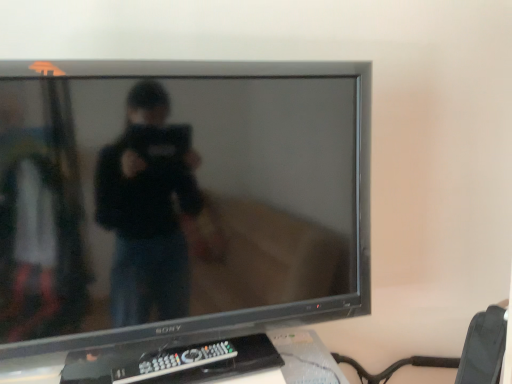
Question: Is black plastic remote at lower center positioned beyond the bounds of satin black tv at center?

Choices:
 (A) yes
 (B) no

Answer: (B)

Question: Does black plastic remote at lower center have a lesser height compared to satin black tv at center?

Choices:
 (A) yes
 (B) no

Answer: (A)

Question: Is black plastic remote at lower center positioned far away from satin black tv at center?

Choices:
 (A) yes
 (B) no

Answer: (B)

Question: From a real-world perspective, is black plastic remote at lower center located beneath satin black tv at center?

Choices:
 (A) yes
 (B) no

Answer: (A)

Question: Is black plastic remote at lower center thinner than satin black tv at center?

Choices:
 (A) no
 (B) yes

Answer: (B)

Question: Can you confirm if black plastic remote at lower center is taller than satin black tv at center?

Choices:
 (A) yes
 (B) no

Answer: (B)

Question: From the image's perspective, is satin black tv at center over black plastic remote at lower center?

Choices:
 (A) no
 (B) yes

Answer: (B)

Question: Does satin black tv at center have a greater width compared to black plastic remote at lower center?

Choices:
 (A) yes
 (B) no

Answer: (A)

Question: Is the depth of satin black tv at center less than that of black plastic remote at lower center?

Choices:
 (A) no
 (B) yes

Answer: (B)

Question: Does satin black tv at center have a lesser width compared to black plastic remote at lower center?

Choices:
 (A) yes
 (B) no

Answer: (B)

Question: Is satin black tv at center looking in the opposite direction of black plastic remote at lower center?

Choices:
 (A) no
 (B) yes

Answer: (B)

Question: From a real-world perspective, is satin black tv at center located higher than black plastic remote at lower center?

Choices:
 (A) yes
 (B) no

Answer: (A)

Question: From the image's perspective, is satin black tv at center located above or below black plastic remote at lower center?

Choices:
 (A) above
 (B) below

Answer: (A)